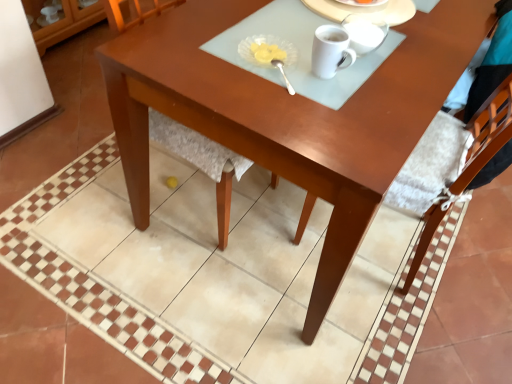
Find the location of a particular element. The image size is (512, 384). empty space that is to the right of translucent glass dish at upper center, the 2th tableware ordered from the bottom is located at coordinates (314, 76).